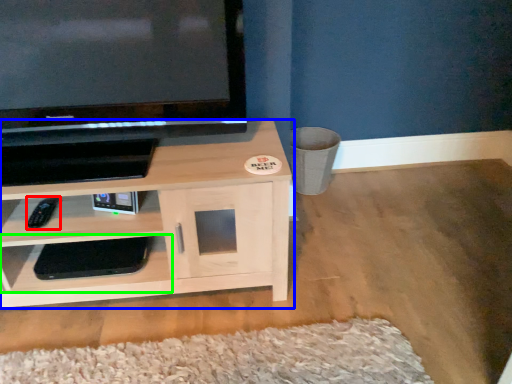
Question: Based on their relative distances, which object is nearer to remote (highlighted by a red box)? Choose from shelf (highlighted by a blue box) and shelf (highlighted by a green box).

Choices:
 (A) shelf
 (B) shelf

Answer: (B)